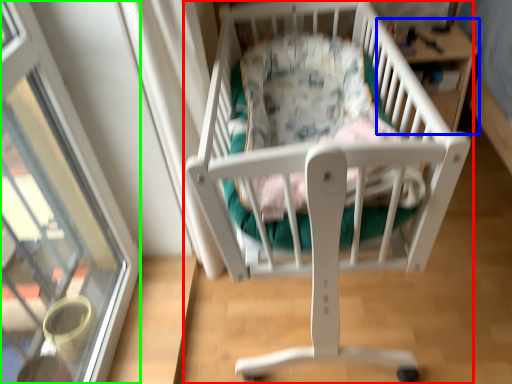
Question: Considering the real-world distances, which object is farthest from infant bed (highlighted by a red box)? table (highlighted by a blue box) or glass door (highlighted by a green box)?

Choices:
 (A) table
 (B) glass door

Answer: (A)